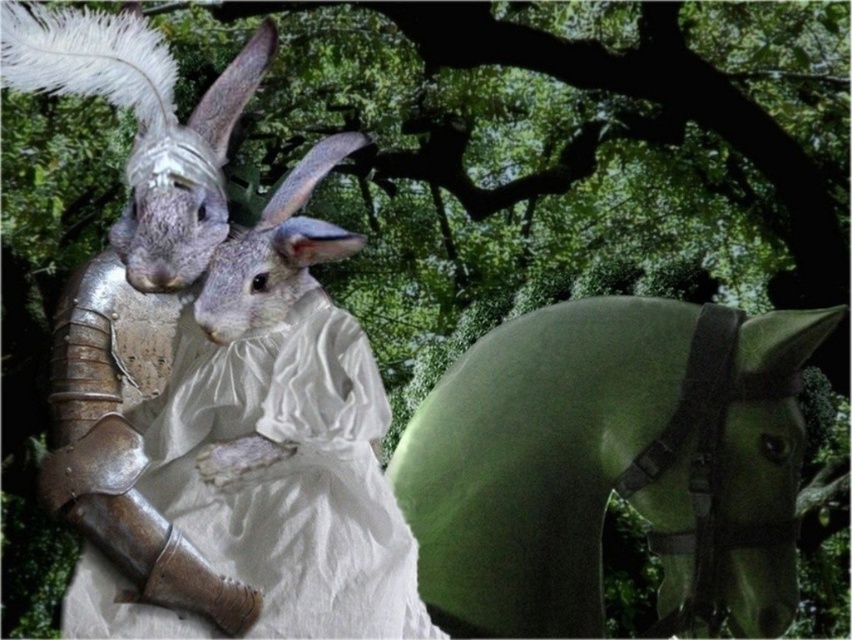
Does green felt horse at right appear on the right side of white satin dress at center?

Indeed, green felt horse at right is positioned on the right side of white satin dress at center.

Who is positioned more to the right, green felt horse at right or white satin dress at center?

Positioned to the right is green felt horse at right.

Where is `green felt horse at right`? This screenshot has height=640, width=852. green felt horse at right is located at coordinates (611, 465).